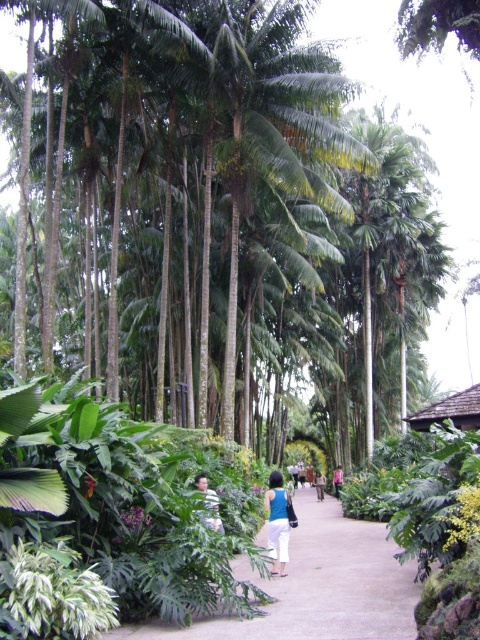
Question: Can you confirm if smooth concrete path at center is positioned to the right of light blue fabric shirt at center?

Choices:
 (A) no
 (B) yes

Answer: (B)

Question: Which point is closer to the camera?

Choices:
 (A) light blue fabric shirt at center
 (B) light brown leather jacket at center
 (C) smooth concrete path at center

Answer: (C)

Question: Which of these objects is positioned closest to the blue fabric shirt at center?

Choices:
 (A) light brown leather jacket at center
 (B) blue denim jeans at center

Answer: (B)

Question: Considering the relative positions of smooth concrete path at center and light brown leather jacket at center in the image provided, where is smooth concrete path at center located with respect to light brown leather jacket at center?

Choices:
 (A) below
 (B) above

Answer: (B)

Question: Which of the following is the farthest from the observer?

Choices:
 (A) (335, 480)
 (B) (314, 476)
 (C) (215, 636)

Answer: (B)

Question: Can you confirm if blue fabric shirt at center is positioned to the left of light blue fabric shirt at center?

Choices:
 (A) no
 (B) yes

Answer: (A)